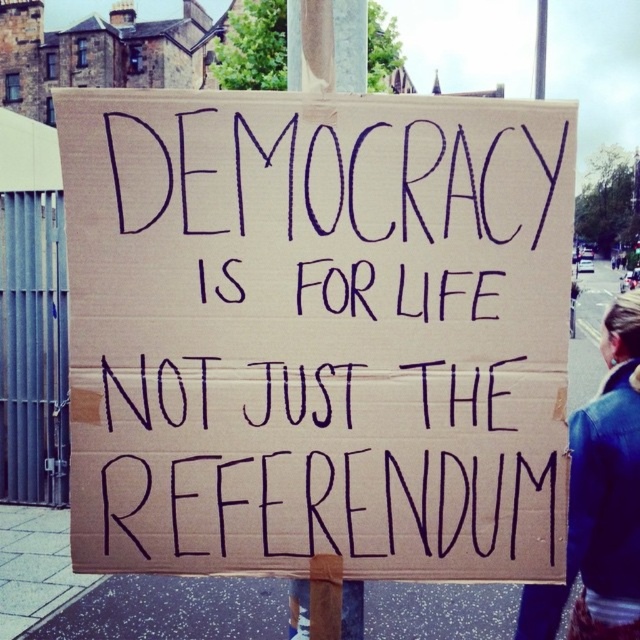
Can you confirm if brown cardboard sign at center is smaller than leather jacket at lower right?

Correct, brown cardboard sign at center occupies less space than leather jacket at lower right.

Is brown cardboard sign at center further to the viewer compared to leather jacket at lower right?

No, brown cardboard sign at center is in front of leather jacket at lower right.

Who is more distant from viewer, [333,317] or [634,483]?

The point [634,483] is more distant.

In order to click on brown cardboard sign at center in this screenshot , I will do `click(316, 332)`.

Based on the photo, who is taller, leather jacket at lower right or wooden post at center?

leather jacket at lower right is taller.

How far apart are leather jacket at lower right and wooden post at center?

leather jacket at lower right is 4.24 feet away from wooden post at center.

What are the coordinates of `leather jacket at lower right` in the screenshot? It's located at (600, 500).

At what (x,y) coordinates should I click in order to perform the action: click on leather jacket at lower right. Please return your answer as a coordinate pair (x, y). Looking at the image, I should click on (600, 500).

Can you confirm if brown cardboard sign at center is positioned to the left of wooden post at center?

Incorrect, brown cardboard sign at center is not on the left side of wooden post at center.

Is brown cardboard sign at center wider than wooden post at center?

Correct, the width of brown cardboard sign at center exceeds that of wooden post at center.

Which is behind, point (326, 157) or point (356, 616)?

The point (356, 616) is more distant.

You are a GUI agent. You are given a task and a screenshot of the screen. Output one action in this format:
    pyautogui.click(x=<x>, y=<y>)
    Task: Click on the brown cardboard sign at center
    The height and width of the screenshot is (640, 640).
    Given the screenshot: What is the action you would take?
    pyautogui.click(x=316, y=332)